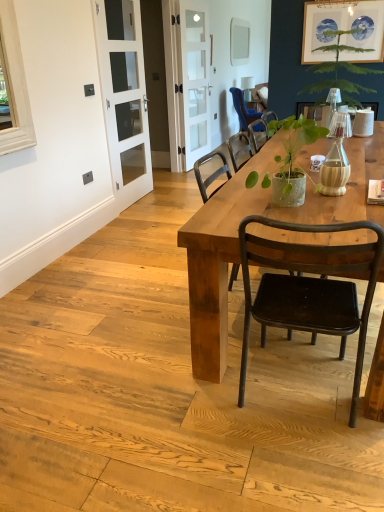
Measure the distance between point (x=294, y=193) and camera.

A distance of 1.83 meters exists between point (x=294, y=193) and camera.

What do you see at coordinates (238, 239) in the screenshot? I see `wooden table at center` at bounding box center [238, 239].

Measure the distance between point (x=350, y=8) and camera.

3.16 meters.

Identify the location of white glass screen door at left, the first screen door positioned from the front. This screenshot has height=512, width=384. (124, 96).

The width and height of the screenshot is (384, 512). What do you see at coordinates (124, 96) in the screenshot? I see `white glass screen door at left, which is counted as the second screen door, starting from the back` at bounding box center [124, 96].

You are a GUI agent. You are given a task and a screenshot of the screen. Output one action in this format:
    pyautogui.click(x=<x>, y=<y>)
    Task: Click on the green textured pot at center
    This screenshot has width=384, height=512.
    Given the screenshot: What is the action you would take?
    pyautogui.click(x=292, y=159)

Considering the relative positions of clear glass door at center, which ranks as the first screen door in right-to-left order, and green leafy plant at upper right in the image provided, is clear glass door at center, which ranks as the first screen door in right-to-left order, to the right of green leafy plant at upper right from the viewer's perspective?

No.

Between clear glass door at center, the 1th screen door in the back-to-front sequence, and green leafy plant at upper right, which one is positioned behind?

clear glass door at center, the 1th screen door in the back-to-front sequence, is further from the camera.

Considering the sizes of objects clear glass door at center, which ranks as the first screen door in right-to-left order, and green leafy plant at upper right in the image provided, who is smaller, clear glass door at center, which ranks as the first screen door in right-to-left order, or green leafy plant at upper right?

Smaller between the two is clear glass door at center, which ranks as the first screen door in right-to-left order.

Who is shorter, clear glass door at center, the 1th screen door in the back-to-front sequence, or green leafy plant at upper right?

Standing shorter between the two is green leafy plant at upper right.

How distant is white glass screen door at left, the first screen door positioned from the front, from clear glass door at center, which ranks as the first screen door in right-to-left order?

white glass screen door at left, the first screen door positioned from the front, is 34.31 inches away from clear glass door at center, which ranks as the first screen door in right-to-left order.

Looking at this image, which of these two, white glass screen door at left, which is the second screen door in right-to-left order, or clear glass door at center, the 2th screen door positioned from the front, is thinner?

clear glass door at center, the 2th screen door positioned from the front, is thinner.

Is the depth of white glass screen door at left, which is counted as the second screen door, starting from the back, less than that of clear glass door at center, the 2th screen door positioned from the front?

Yes, white glass screen door at left, which is counted as the second screen door, starting from the back, is in front of clear glass door at center, the 2th screen door positioned from the front.

Identify the location of screen door located behind the white glass screen door at left, which is counted as the second screen door, starting from the back. (195, 81).

Relative to green leafy plant at upper right, is matte gray power outlet at upper left in front or behind?

Visually, matte gray power outlet at upper left is located behind green leafy plant at upper right.

How many degrees apart are the facing directions of matte gray power outlet at upper left and green leafy plant at upper right?

They differ by 88.6 degrees in their facing directions.

Is matte gray power outlet at upper left oriented towards green leafy plant at upper right?

No, matte gray power outlet at upper left is not aimed at green leafy plant at upper right.

Between matte gray power outlet at upper left and green leafy plant at upper right, which one has more height?

Standing taller between the two is green leafy plant at upper right.

Is point (86, 181) behind point (128, 15)?

No, (86, 181) is in front of (128, 15).

In the scene shown: From the image's perspective, is matte gray power outlet at upper left on top of white glass screen door at left, which is the second screen door in right-to-left order?

Incorrect, from the image's perspective, matte gray power outlet at upper left is lower than white glass screen door at left, which is the second screen door in right-to-left order.

Considering the relative positions of matte gray power outlet at upper left and white glass screen door at left, which ranks as the 1th screen door in left-to-right order, in the image provided, is matte gray power outlet at upper left to the left or to the right of white glass screen door at left, which ranks as the 1th screen door in left-to-right order,?

matte gray power outlet at upper left is positioned on white glass screen door at left, which ranks as the 1th screen door in left-to-right order,'s left side.

Which of these two, matte gray power outlet at upper left or matte white picture frame at upper right, stands shorter?

With less height is matte gray power outlet at upper left.

Is matte gray power outlet at upper left touching matte white picture frame at upper right?

There is a gap between matte gray power outlet at upper left and matte white picture frame at upper right.

Is matte gray power outlet at upper left smaller than matte white picture frame at upper right?

Yes.

Is matte gray power outlet at upper left thinner than matte white picture frame at upper right?

Yes.

Looking at their sizes, would you say matte white picture frame at upper right is wider or thinner than matte black chair at center, the 2th chair from the back?

Clearly, matte white picture frame at upper right has less width compared to matte black chair at center, the 2th chair from the back.

Between point (326, 7) and point (363, 249), which one is positioned in front?

The point (363, 249) is more forward.

Can you see matte white picture frame at upper right touching matte black chair at center, the 2th chair from the top?

No, matte white picture frame at upper right is not beside matte black chair at center, the 2th chair from the top.

Is matte white picture frame at upper right facing towards matte black chair at center, the 1th chair viewed from the front?

Yes, matte white picture frame at upper right is aimed at matte black chair at center, the 1th chair viewed from the front.

From the image's perspective, count 2nd screen doors upward from the matte black chair at center, the 2th chair from the back, and point to it. Please provide its 2D coordinates.

[(195, 81)]

In the scene shown: Is clear glass door at center, the 1th screen door in the back-to-front sequence, smaller than matte black chair at center, the 1th chair positioned from the bottom?

Yes.

Looking at this image, is clear glass door at center, the 1th screen door in the back-to-front sequence, in front of or behind matte black chair at center, the 1th chair positioned from the bottom, in the image?

clear glass door at center, the 1th screen door in the back-to-front sequence, is positioned farther from the viewer than matte black chair at center, the 1th chair positioned from the bottom.

At what (x,y) coordinates should I click in order to perform the action: click on plant that is below the clear glass door at center, the second screen door in the left-to-right sequence (from the image's perspective). Please return your answer as a coordinate pair (x, y). This screenshot has width=384, height=512. Looking at the image, I should click on (340, 68).

I want to click on screen door that appears below the clear glass door at center, the 1th screen door in the back-to-front sequence (from a real-world perspective), so click(124, 96).

Considering their positions, is matte black chair at center, the 1th chair viewed from the front, positioned further to green textured pot at center than matte gray power outlet at upper left?

matte gray power outlet at upper left.

Based on their spatial positions, is green textured pot at center or clear glass door at center, the second screen door in the left-to-right sequence, closer to matte gray power outlet at upper left?

The object closer to matte gray power outlet at upper left is clear glass door at center, the second screen door in the left-to-right sequence.

Which object lies further to the anchor point wooden table at center, clear glass door at center, the second screen door in the left-to-right sequence, or white glass screen door at left, which is counted as the second screen door, starting from the back?

Based on the image, clear glass door at center, the second screen door in the left-to-right sequence, appears to be further to wooden table at center.

Looking at this image, considering their positions, is matte black chair at center, the 1th chair viewed from the front, positioned closer to matte white picture frame at upper right than clear glass door at center, which ranks as the first screen door in right-to-left order?

Among the two, clear glass door at center, which ranks as the first screen door in right-to-left order, is located nearer to matte white picture frame at upper right.

Which object lies nearer to the anchor point green leafy plant at upper right, white glass screen door at left, which is the second screen door in right-to-left order, or clear glass door at center, the second screen door in the left-to-right sequence?

Based on the image, clear glass door at center, the second screen door in the left-to-right sequence, appears to be nearer to green leafy plant at upper right.

From the image, which object appears to be farther from blue fabric chair at upper center, the 2th chair from the front, wooden table at center or matte white picture frame at upper right?

wooden table at center lies further to blue fabric chair at upper center, the 2th chair from the front, than the other object.

Considering their positions, is white glass screen door at left, which ranks as the 1th screen door in left-to-right order, positioned further to green leafy plant at upper right than matte black chair at center, the 2th chair from the back?

matte black chair at center, the 2th chair from the back.

Based on their spatial positions, is white glass screen door at left, the first screen door positioned from the front, or clear glass door at center, which ranks as the first screen door in right-to-left order, closer to matte gray power outlet at upper left?

white glass screen door at left, the first screen door positioned from the front, is positioned closer to the anchor matte gray power outlet at upper left.

This screenshot has height=512, width=384. What are the coordinates of `screen door between green leafy plant at upper right and clear glass door at center, which ranks as the first screen door in right-to-left order, from front to back` in the screenshot? It's located at (124, 96).

Identify the location of plant between matte black chair at center, the 1th chair positioned from the bottom, and blue fabric chair at upper center, which appears as the 1th chair when viewed from the top, in the front-back direction. The image size is (384, 512). (340, 68).

This screenshot has width=384, height=512. I want to click on screen door located between matte black chair at center, the 1th chair viewed from the front, and matte gray power outlet at upper left in the depth direction, so click(124, 96).

Where is `screen door located between wooden table at center and clear glass door at center, which ranks as the first screen door in right-to-left order, in the depth direction`? screen door located between wooden table at center and clear glass door at center, which ranks as the first screen door in right-to-left order, in the depth direction is located at coordinates (124, 96).